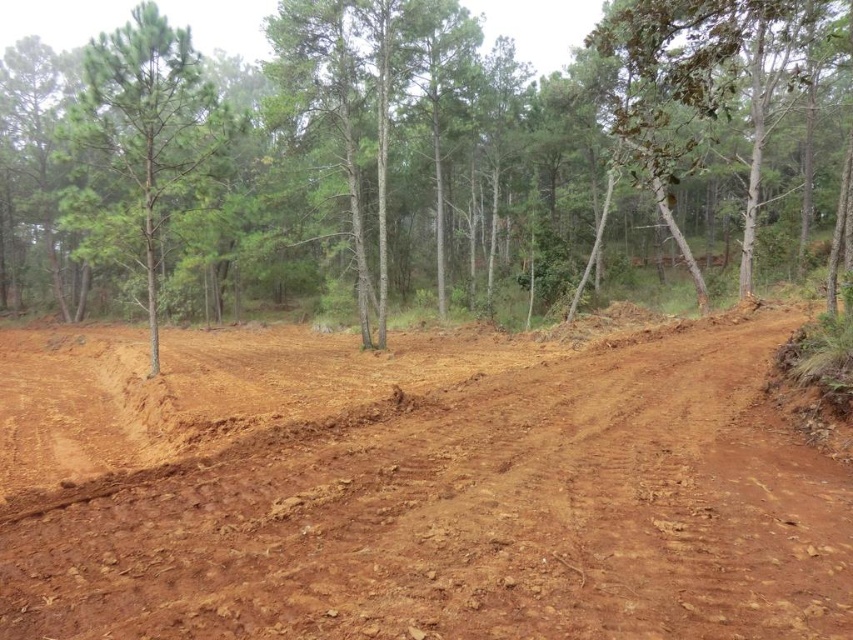
Question: Is brown clay dirt at center closer to camera compared to green textured tree at upper left?

Choices:
 (A) yes
 (B) no

Answer: (A)

Question: Does brown clay dirt at center appear over green leafy tree at upper right?

Choices:
 (A) yes
 (B) no

Answer: (B)

Question: Which of these objects is positioned closest to the green textured tree at upper left?

Choices:
 (A) green matte tree at left
 (B) green leafy tree at upper right
 (C) brown clay dirt at center

Answer: (A)

Question: Based on their relative distances, which object is nearer to the green matte tree at left?

Choices:
 (A) green leafy tree at upper right
 (B) brown clay dirt at center

Answer: (B)

Question: Observing the image, what is the correct spatial positioning of brown clay dirt at center in reference to green leafy tree at upper right?

Choices:
 (A) left
 (B) right

Answer: (A)

Question: Which point is closer to the camera?

Choices:
 (A) (637, 115)
 (B) (674, 593)

Answer: (B)